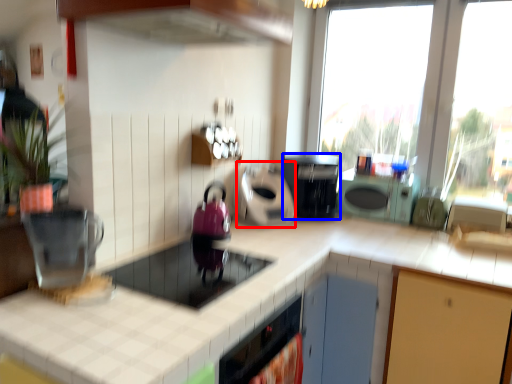
Question: Which object appears farthest to the camera in this image, appliance (highlighted by a red box) or kitchen appliance (highlighted by a blue box)?

Choices:
 (A) appliance
 (B) kitchen appliance

Answer: (B)